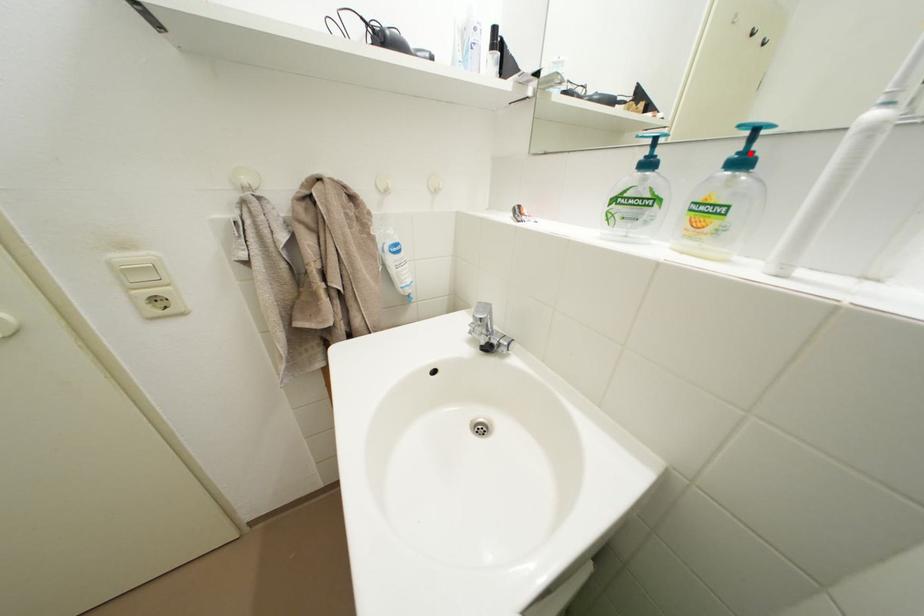
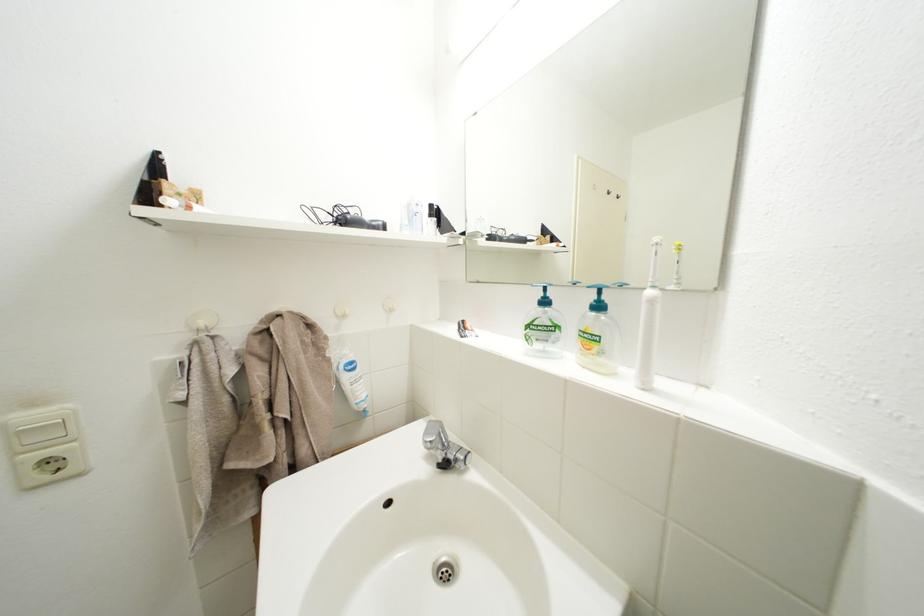
In the second image, find the point that corresponds to the highlighted location in the first image.

(604, 302)